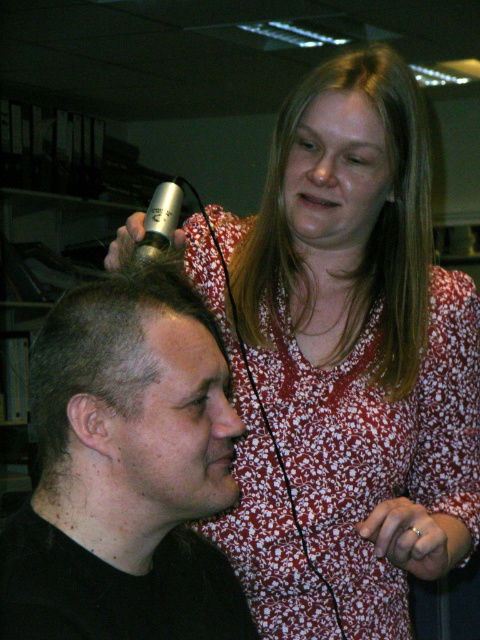
Find the location of a particular element. matte silver hair clipper at upper center is located at coordinates (346, 362).

Which is in front, point (457, 429) or point (145, 456)?

Point (145, 456)

Is point (273, 509) farther from viewer compared to point (119, 561)?

That is True.

I want to click on matte silver hair clipper at upper center, so [346, 362].

Can you confirm if matte silver hair clipper at upper center is thinner than blonde smooth hair at upper center?

No, matte silver hair clipper at upper center is not thinner than blonde smooth hair at upper center.

Which is more to the right, matte silver hair clipper at upper center or blonde smooth hair at upper center?

blonde smooth hair at upper center

The image size is (480, 640). In order to click on matte silver hair clipper at upper center in this screenshot , I will do `click(346, 362)`.

Between smooth black hair at center and blonde smooth hair at upper center, which one appears on the right side from the viewer's perspective?

blonde smooth hair at upper center

Who is more forward, (108, 316) or (409, 228)?

Positioned in front is point (108, 316).

Who is more distant from viewer, (168,577) or (393,224)?

The point (393,224) is behind.

The width and height of the screenshot is (480, 640). In order to click on smooth black hair at center in this screenshot , I will do `click(126, 472)`.